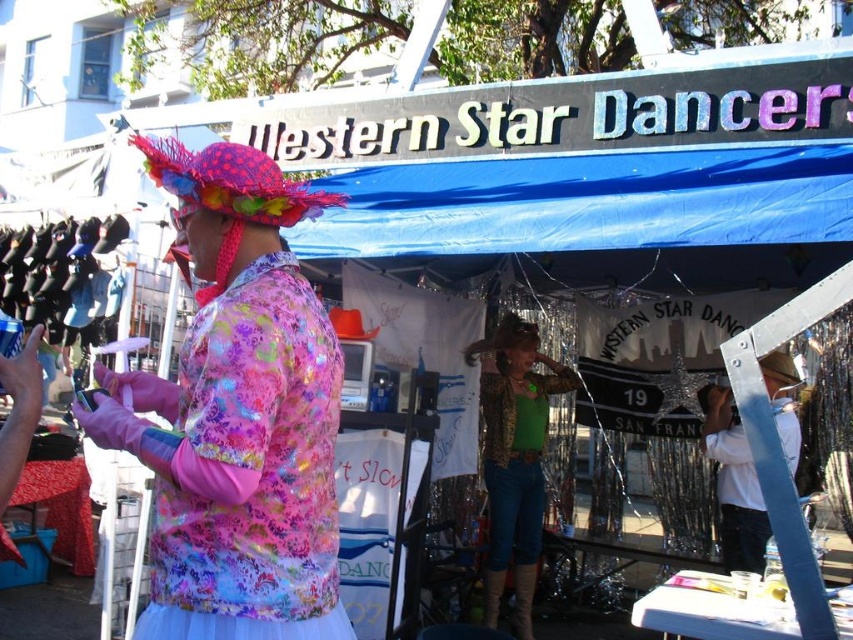
Does floral shiny fabric dress at left lie in front of white cotton shirt at center?

Yes, it is in front of white cotton shirt at center.

Which is more to the left, floral shiny fabric dress at left or white cotton shirt at center?

Positioned to the left is floral shiny fabric dress at left.

Does point (170, 392) come behind point (721, 445)?

No, (170, 392) is in front of (721, 445).

Where is `floral shiny fabric dress at left`? floral shiny fabric dress at left is located at coordinates (247, 467).

The width and height of the screenshot is (853, 640). Identify the location of leopard print jacket at center. (514, 458).

Does leopard print jacket at center appear on the right side of white cotton shirt at center?

No, leopard print jacket at center is not to the right of white cotton shirt at center.

The image size is (853, 640). Find the location of `leopard print jacket at center`. leopard print jacket at center is located at coordinates (514, 458).

This screenshot has width=853, height=640. In order to click on leopard print jacket at center in this screenshot , I will do `click(514, 458)`.

Who is more distant from viewer, (293, 368) or (535, 458)?

Positioned behind is point (535, 458).

Locate an element on the screen. The width and height of the screenshot is (853, 640). floral shiny fabric dress at left is located at coordinates (247, 467).

Locate an element on the screen. floral shiny fabric dress at left is located at coordinates (247, 467).